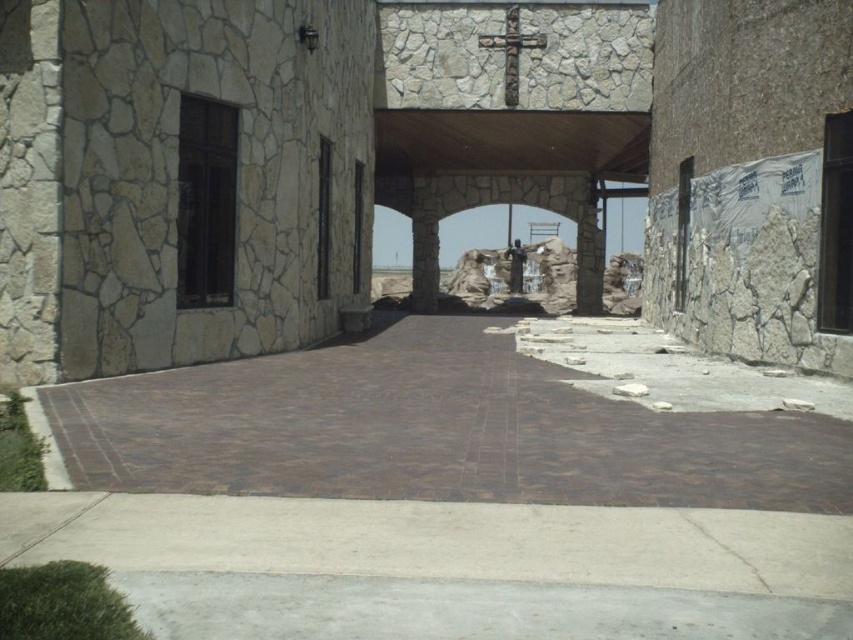
Can you confirm if brown stone pillar at center is positioned to the right of black stone door at center?

Correct, you'll find brown stone pillar at center to the right of black stone door at center.

Consider the image. Does brown stone pillar at center appear over black stone door at center?

Correct, brown stone pillar at center is located above black stone door at center.

Which is behind, point (433, 296) or point (318, 225)?

Point (433, 296)

This screenshot has height=640, width=853. I want to click on brown stone pillar at center, so click(x=424, y=260).

Does stone textured column at center have a smaller size compared to brown stone pillar at center?

Incorrect, stone textured column at center is not smaller in size than brown stone pillar at center.

Who is shorter, stone textured column at center or brown stone pillar at center?

brown stone pillar at center

Describe the element at coordinates (589, 252) in the screenshot. I see `stone textured column at center` at that location.

What are the coordinates of `stone textured column at center` in the screenshot? It's located at (589, 252).

Between point (842, 211) and point (599, 230), which one is positioned behind?

The point (599, 230) is behind.

Which of these two, black glass door at right or stone textured column at center, stands shorter?

black glass door at right

Which is in front, point (849, 253) or point (579, 228)?

Positioned in front is point (849, 253).

The image size is (853, 640). In order to click on black glass door at right in this screenshot , I will do `click(834, 227)`.